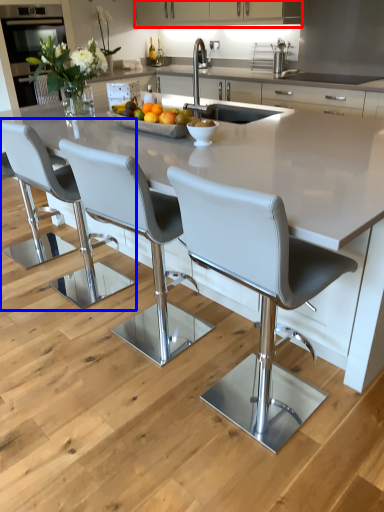
Question: Among these objects, which one is nearest to the camera, cabinetry (highlighted by a red box) or chair (highlighted by a blue box)?

Choices:
 (A) cabinetry
 (B) chair

Answer: (B)